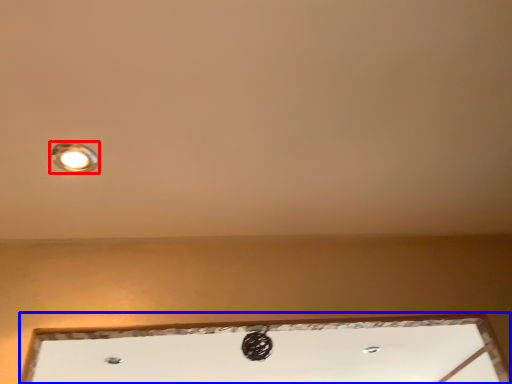
Question: Among these objects, which one is farthest to the camera, lamp (highlighted by a red box) or window (highlighted by a blue box)?

Choices:
 (A) lamp
 (B) window

Answer: (B)